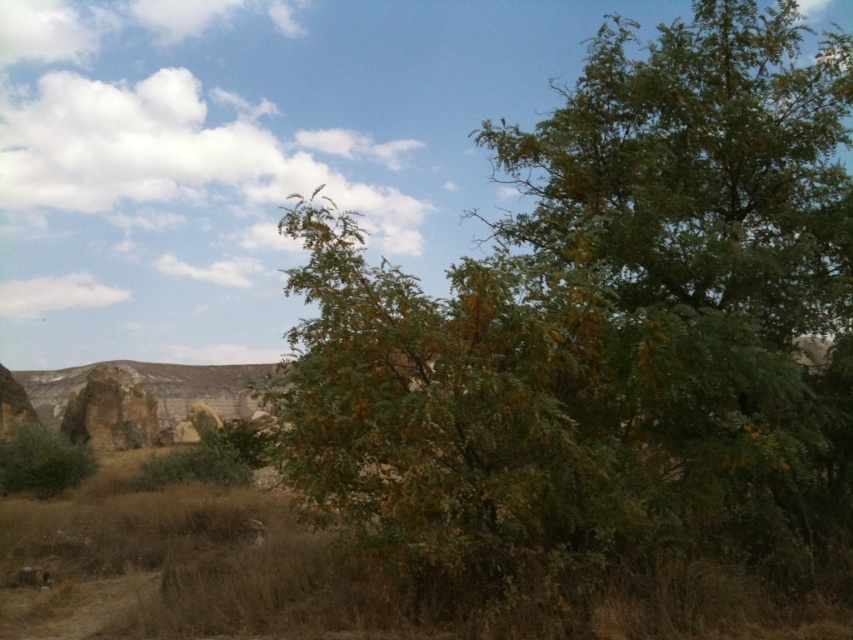
Question: Is green leafy tree at center bigger than rustic stone rock formation at left?

Choices:
 (A) no
 (B) yes

Answer: (B)

Question: Considering the relative positions of green leafy tree at center and green leafy bush at lower left in the image provided, where is green leafy tree at center located with respect to green leafy bush at lower left?

Choices:
 (A) left
 (B) right

Answer: (B)

Question: Which point is closer to the camera taking this photo?

Choices:
 (A) (349, 225)
 (B) (25, 470)
 (C) (138, 600)
 (D) (96, 401)

Answer: (A)

Question: Is green leafy tree at center below rustic stone rock formation at left?

Choices:
 (A) no
 (B) yes

Answer: (A)

Question: Which point appears farthest from the camera in this image?

Choices:
 (A) (129, 432)
 (B) (32, 435)
 (C) (819, 182)

Answer: (A)

Question: Which point appears closest to the camera in this image?

Choices:
 (A) (44, 436)
 (B) (120, 436)

Answer: (A)